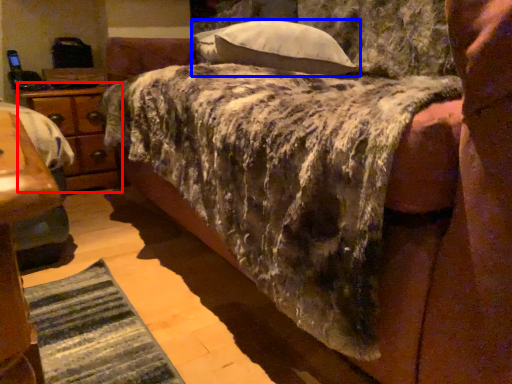
Question: Which point is closer to the camera, nightstand (highlighted by a red box) or pillow (highlighted by a blue box)?

Choices:
 (A) nightstand
 (B) pillow

Answer: (B)